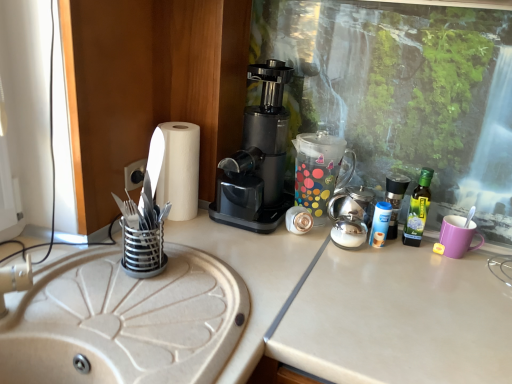
Question: Does blue plastic bottle at right, which appears as the second bottle when viewed from the right, have a greater width compared to black plastic coffee maker at center?

Choices:
 (A) yes
 (B) no

Answer: (B)

Question: Can you confirm if blue plastic bottle at right, which appears as the second bottle when viewed from the right, is taller than black plastic coffee maker at center?

Choices:
 (A) yes
 (B) no

Answer: (B)

Question: From a real-world perspective, does blue plastic bottle at right, which appears as the second bottle when viewed from the right, sit lower than black plastic coffee maker at center?

Choices:
 (A) yes
 (B) no

Answer: (A)

Question: From the image's perspective, is blue plastic bottle at right, which appears as the second bottle when viewed from the right, on black plastic coffee maker at center?

Choices:
 (A) yes
 (B) no

Answer: (B)

Question: Is blue plastic bottle at right, which appears as the second bottle when viewed from the right, outside black plastic coffee maker at center?

Choices:
 (A) yes
 (B) no

Answer: (A)

Question: Is transparent polka dot coffee pot at center situated inside black plastic coffee maker at center or outside?

Choices:
 (A) inside
 (B) outside

Answer: (B)

Question: Relative to black plastic coffee maker at center, is transparent polka dot coffee pot at center in front or behind?

Choices:
 (A) behind
 (B) front

Answer: (A)

Question: Looking at their shapes, would you say transparent polka dot coffee pot at center is wider or thinner than black plastic coffee maker at center?

Choices:
 (A) wide
 (B) thin

Answer: (B)

Question: Is transparent polka dot coffee pot at center taller or shorter than black plastic coffee maker at center?

Choices:
 (A) tall
 (B) short

Answer: (B)

Question: In terms of size, does blue plastic bottle at right, which is the first bottle in left-to-right order, appear bigger or smaller than purple matte mug at right?

Choices:
 (A) big
 (B) small

Answer: (A)

Question: Visually, is blue plastic bottle at right, which is the first bottle in left-to-right order, positioned to the left or to the right of purple matte mug at right?

Choices:
 (A) left
 (B) right

Answer: (A)

Question: Is point (390, 226) closer or farther from the camera than point (455, 215)?

Choices:
 (A) farther
 (B) closer

Answer: (B)

Question: From a real-world perspective, relative to purple matte mug at right, is blue plastic bottle at right, which appears as the second bottle when viewed from the right, vertically above or below?

Choices:
 (A) below
 (B) above

Answer: (B)

Question: Considering the positions of point (124, 182) and point (260, 124), is point (124, 182) closer or farther from the camera than point (260, 124)?

Choices:
 (A) closer
 (B) farther

Answer: (A)

Question: Visually, is black plastic socket at center-left positioned to the left or to the right of black plastic coffee maker at center?

Choices:
 (A) right
 (B) left

Answer: (B)